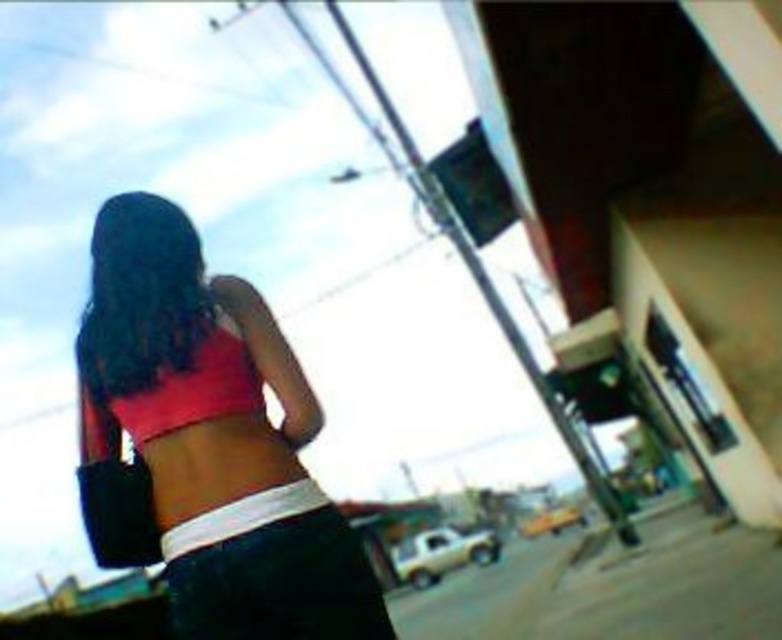
Which is above, pink fabric top at center or pink matte bikini top at center?

pink matte bikini top at center is higher up.

Is pink fabric top at center to the right of pink matte bikini top at center from the viewer's perspective?

Correct, you'll find pink fabric top at center to the right of pink matte bikini top at center.

Which is in front, point (235, 484) or point (226, 390)?

Point (235, 484)

Identify the location of pink fabric top at center. The height and width of the screenshot is (640, 782). (210, 440).